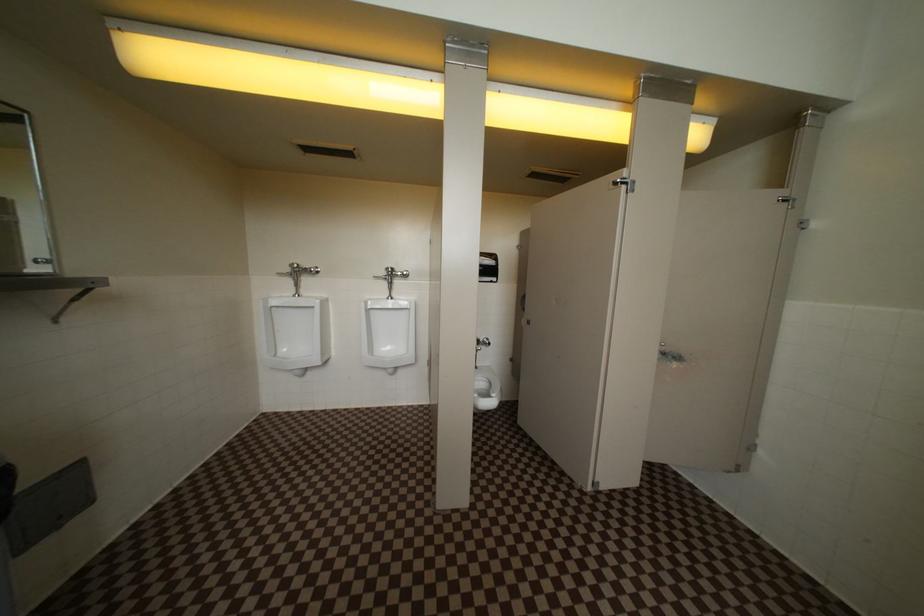
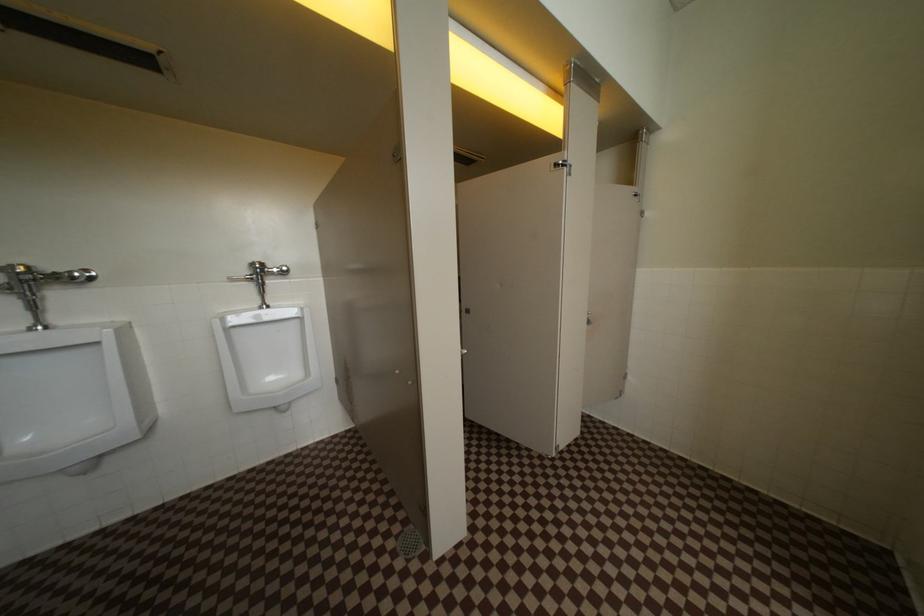
Which direction would the cameraman need to move to produce the second image?

The cameraman moved toward left, forward.